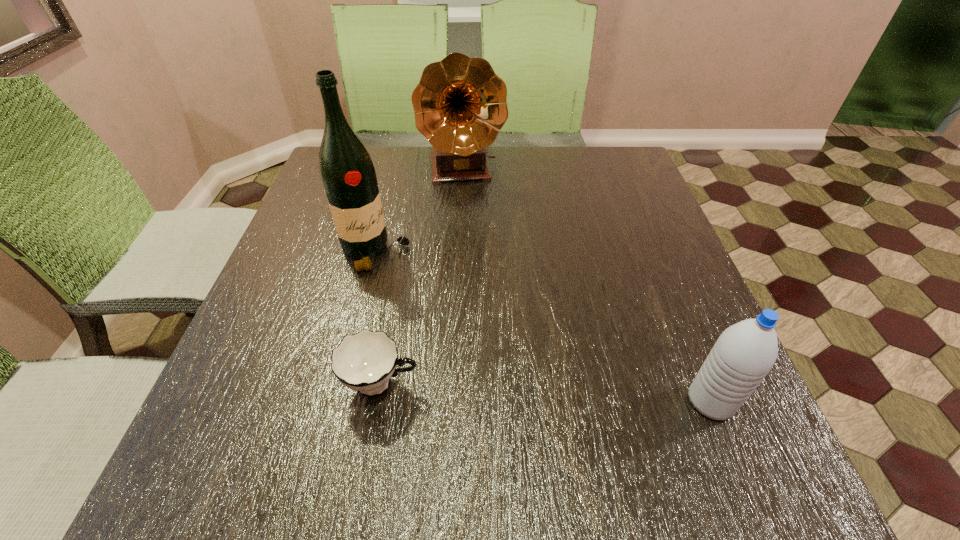
You are a GUI agent. You are given a task and a screenshot of the screen. Output one action in this format:
    pyautogui.click(x=<x>, y=<y>)
    Task: Click on the cup
    The height and width of the screenshot is (540, 960).
    Given the screenshot: What is the action you would take?
    (365, 361)

Image resolution: width=960 pixels, height=540 pixels. I want to click on the rightmost object, so click(x=745, y=352).

At what (x,y) coordinates should I click in order to perform the action: click on the second shortest object. Please return your answer as a coordinate pair (x, y). This screenshot has width=960, height=540. Looking at the image, I should click on (745, 352).

Identify the location of the farthest object. The height and width of the screenshot is (540, 960). (460, 106).

Locate an element on the screen. This screenshot has width=960, height=540. the second tallest object is located at coordinates (460, 106).

The width and height of the screenshot is (960, 540). Find the location of `wine bottle`. wine bottle is located at coordinates (347, 172).

Where is `vacant area located 0.060m on the side of the cup with the handle`? The width and height of the screenshot is (960, 540). vacant area located 0.060m on the side of the cup with the handle is located at coordinates (454, 384).

What are the coordinates of `vacant area situated on the left of the rightmost object` in the screenshot? It's located at (498, 401).

You are a GUI agent. You are given a task and a screenshot of the screen. Output one action in this format:
    pyautogui.click(x=<x>, y=<y>)
    Task: Click on the vacant position located 0.110m on the horn of the phonograph_record
    
    Given the screenshot: What is the action you would take?
    pyautogui.click(x=472, y=219)

The height and width of the screenshot is (540, 960). I want to click on free space located on the horn of the phonograph_record, so click(469, 205).